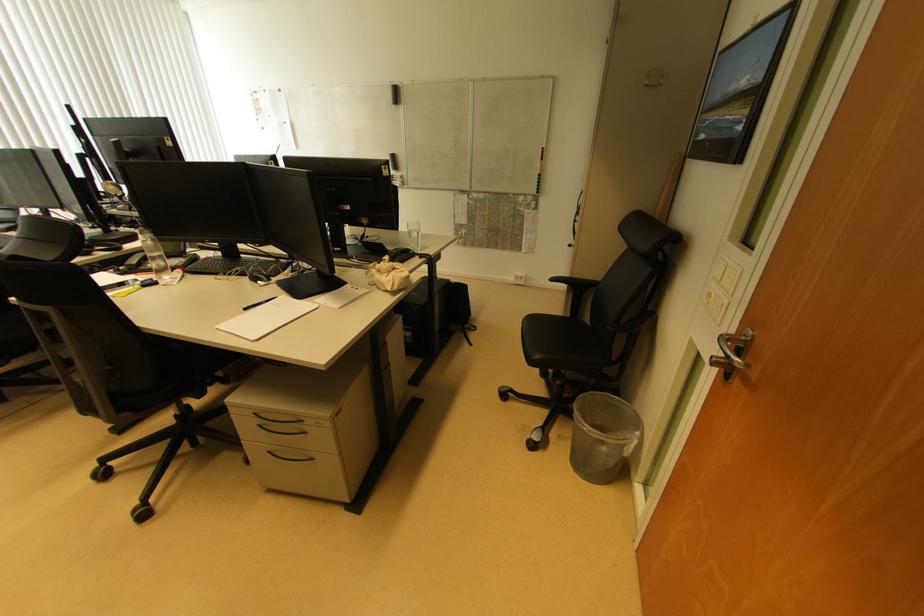
This screenshot has height=616, width=924. Describe the element at coordinates (278, 424) in the screenshot. I see `the drawer handle` at that location.